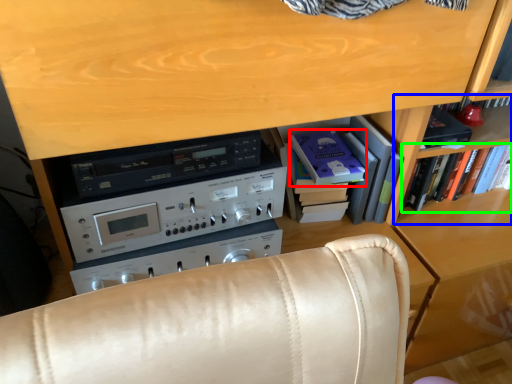
Question: Which is farther away from paperback book (highlighted by a red box)? shelf (highlighted by a blue box) or book (highlighted by a green box)?

Choices:
 (A) shelf
 (B) book

Answer: (B)